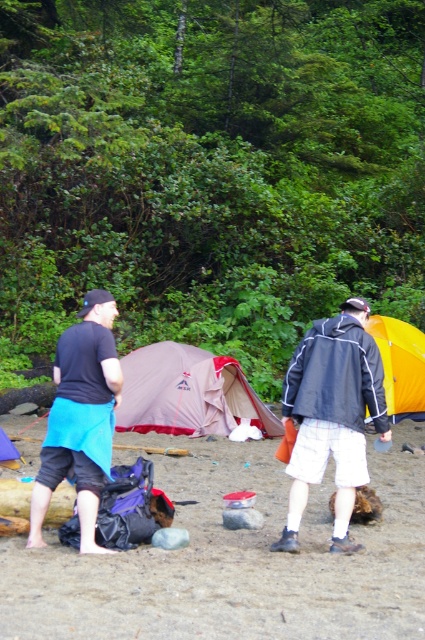
Consider the image. You are standing at the campsite and want to take a photo of the point at coordinates (370, 340). If your camera has a maximum focus range of 7 meters, will it be able to focus on that point?

The distance of point (370, 340) from the camera is 6.85 meters, which is within the camera maximum focus range of 7 meters. Therefore, the camera can focus on that point.

You are standing at the campsite and want to place a small flag exactly halfway between point (x=193, y=492) and point (x=11, y=454). Which direction should you move from the first point to reach the midpoint?

To find the midpoint between point (x=193, y=492) and point (x=11, y=454), you would move downward and slightly to the left from the first point because the second point is lower and to the right of the first point.

You are a hiker planning to cross a narrow bridge. You see the dark gray jacket at center and the blue fabric shorts at lower left in your path. Which item is closer to the ground?

The dark gray jacket at center is shorter than the blue fabric shorts at lower left, so the dark gray jacket at center is closer to the ground.